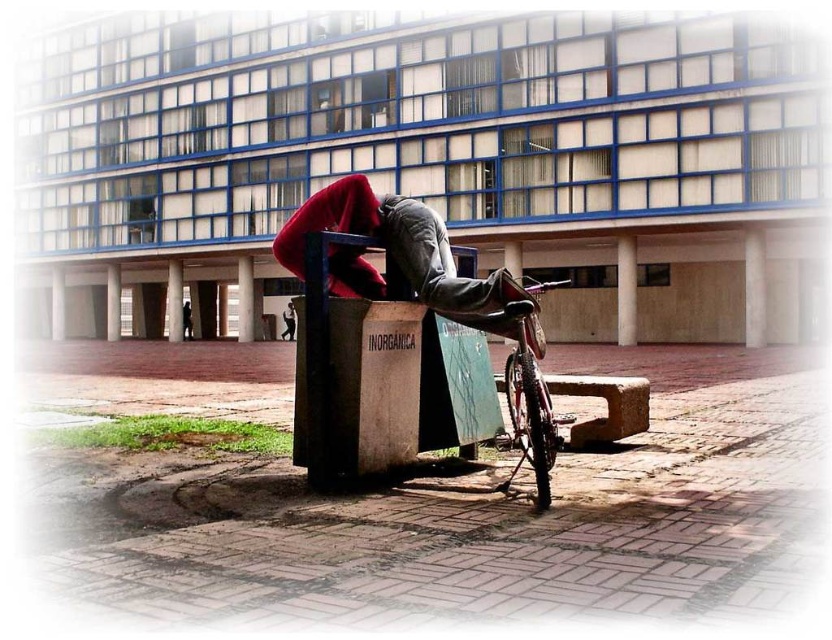
Question: Considering the real-world distances, which object is closest to the shiny metallic bicycle at lower right?

Choices:
 (A) dark gray jeans at lower center
 (B) dark gray jeans at center

Answer: (B)

Question: Among these objects, which one is farthest from the camera?

Choices:
 (A) dark gray jeans at center
 (B) red fabric at center

Answer: (A)

Question: Which object appears closest to the camera in this image?

Choices:
 (A) dark gray jeans at lower center
 (B) red fabric at center
 (C) shiny metallic bicycle at lower right
 (D) dark gray jeans at center

Answer: (C)

Question: Does dark gray jeans at center come in front of dark gray jeans at lower center?

Choices:
 (A) no
 (B) yes

Answer: (B)

Question: Does dark gray jeans at center appear under dark gray jeans at lower center?

Choices:
 (A) yes
 (B) no

Answer: (B)

Question: Does shiny metallic bicycle at lower right have a lesser width compared to dark gray jeans at center?

Choices:
 (A) no
 (B) yes

Answer: (A)